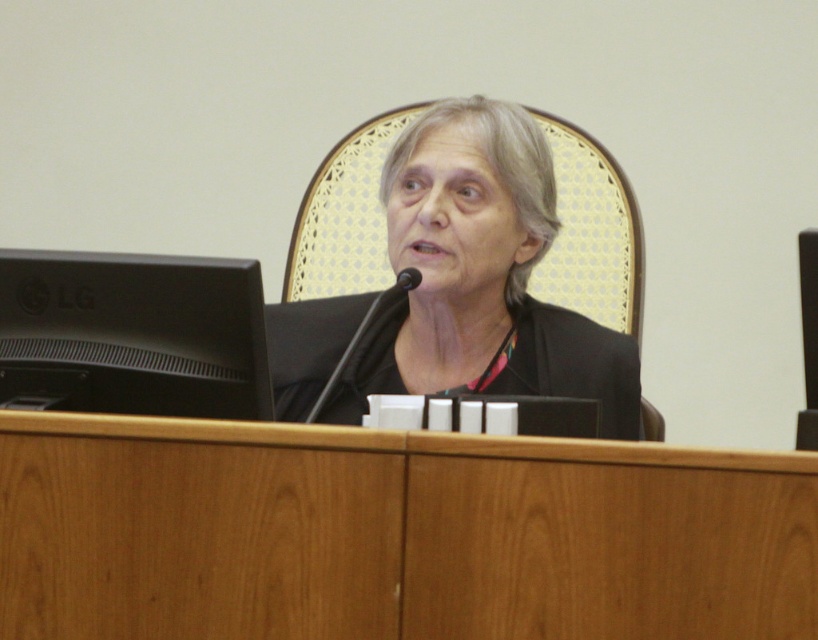
You are standing in the courtroom and want to touch the black matte or black fabric at center. Which direction should you move relative to the point at coordinates (x=497, y=243)?

The point at coordinates (x=497, y=243) corresponds to the black matte or black fabric at center, so you are already at the correct location to touch it. No movement is necessary.